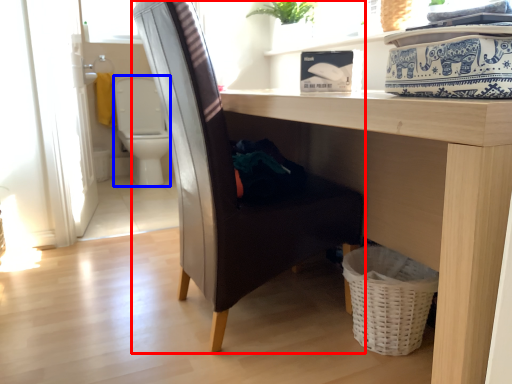
Question: Which object appears closest to the camera in this image, chair (highlighted by a red box) or swivel chair (highlighted by a blue box)?

Choices:
 (A) chair
 (B) swivel chair

Answer: (A)